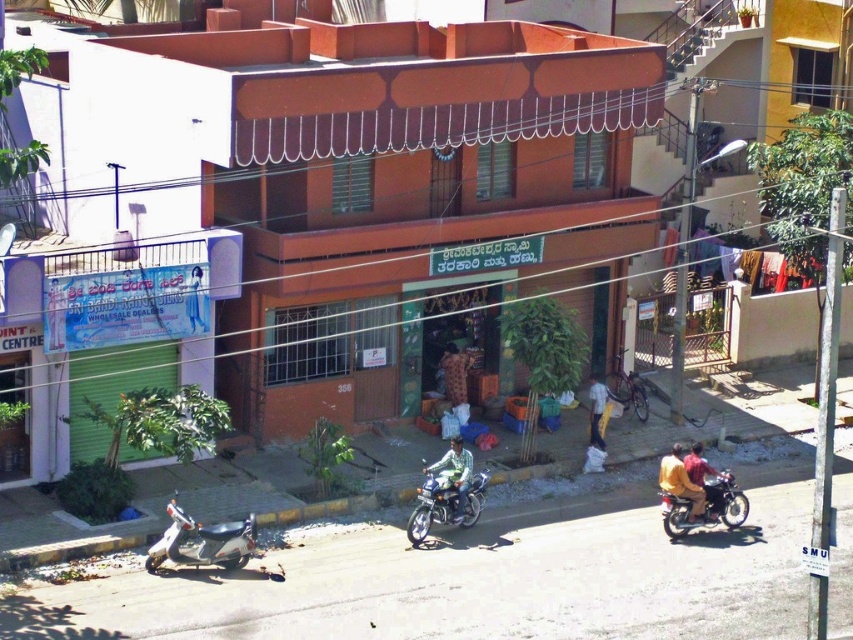
Question: Among these objects, which one is nearest to the camera?

Choices:
 (A) silver metallic scooter at lower left
 (B) green matte shirt at center

Answer: (A)

Question: Is yellow fabric shirt at center to the right of green matte shirt at center from the viewer's perspective?

Choices:
 (A) no
 (B) yes

Answer: (B)

Question: From the image, what is the correct spatial relationship of silver metallic scooter at lower left in relation to shiny black motorcycle at lower right?

Choices:
 (A) right
 (B) left

Answer: (B)

Question: Is shiny metallic motorcycle at center closer to the viewer compared to yellow fabric shirt at center?

Choices:
 (A) no
 (B) yes

Answer: (B)

Question: Which object is positioned closest to the green matte shirt at center?

Choices:
 (A) yellow fabric shirt at center
 (B) silver metallic scooter at lower left

Answer: (A)

Question: Among these objects, which one is nearest to the camera?

Choices:
 (A) yellow fabric shirt at center
 (B) yellow fabric jacket at lower right

Answer: (B)